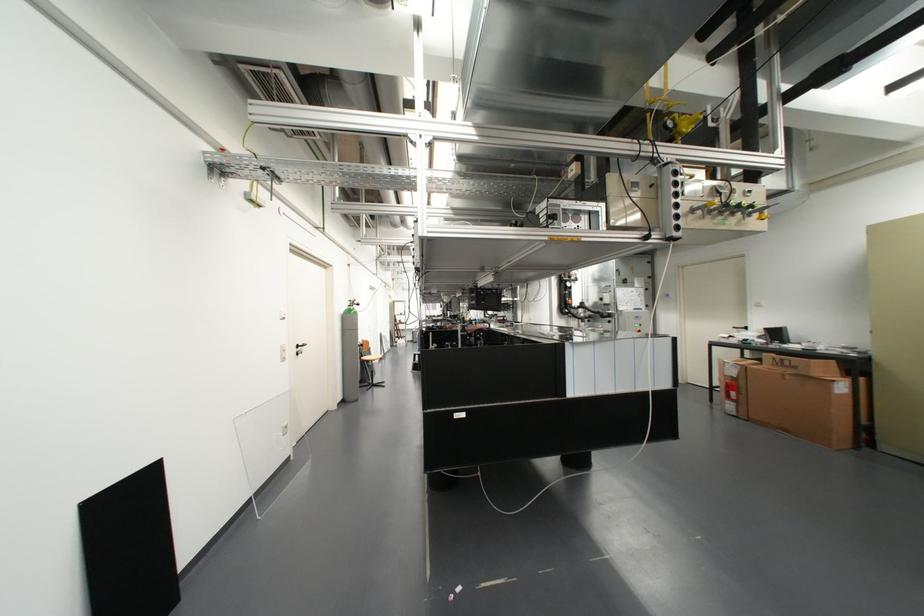
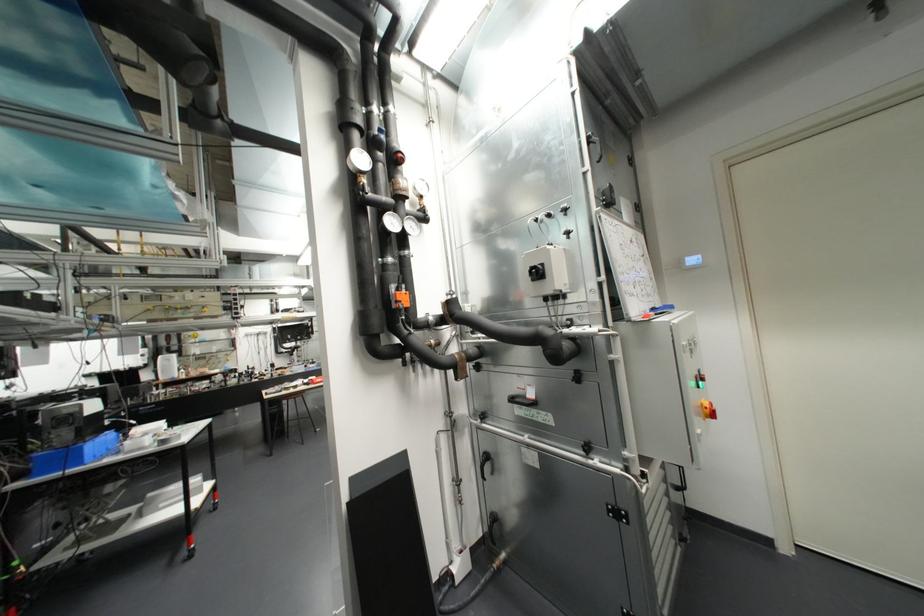
Find the pixel in the second image that matches pixel 601 299 in the first image.

(537, 273)